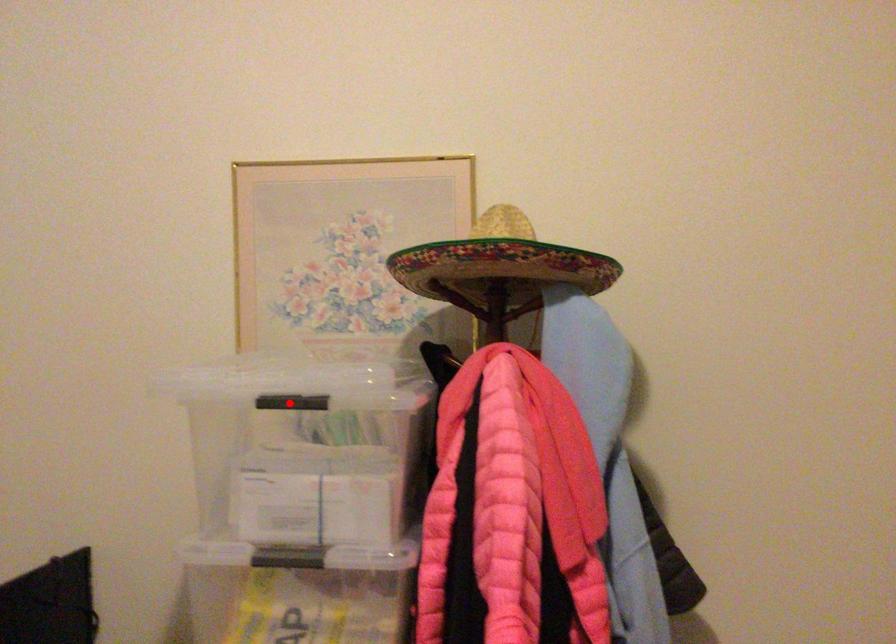
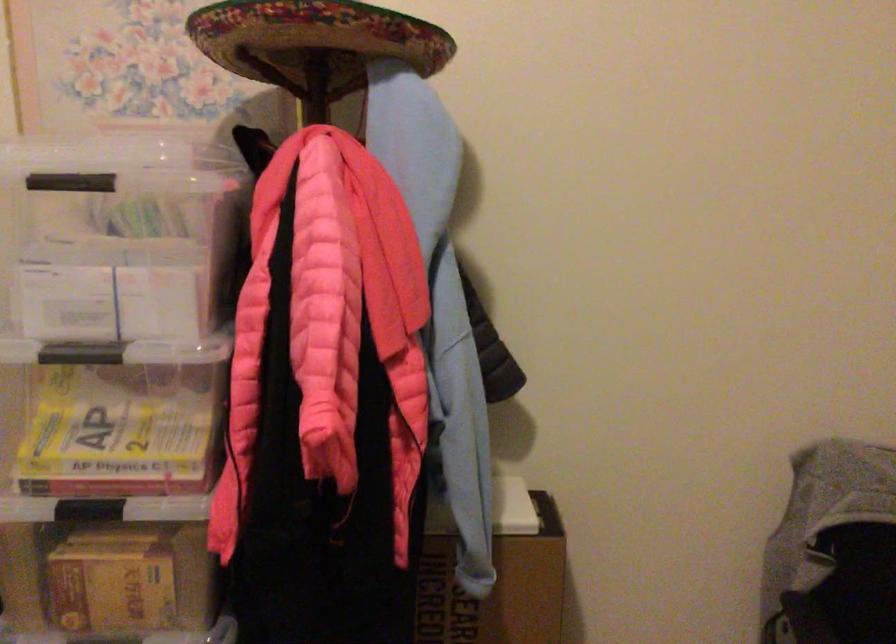
The point at the highlighted location is marked in the first image. Where is the corresponding point in the second image?

(71, 181)